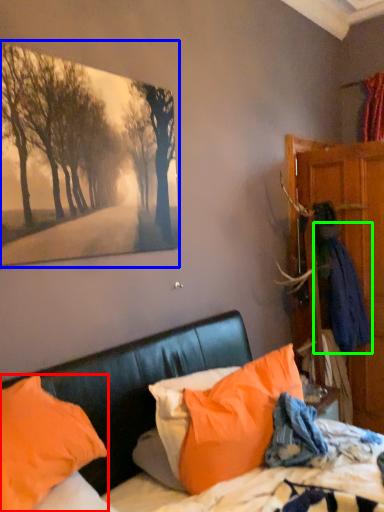
Question: Based on their relative distances, which object is farther from pillow (highlighted by a red box)? Choose from picture frame (highlighted by a blue box) and clothing (highlighted by a green box).

Choices:
 (A) picture frame
 (B) clothing

Answer: (B)